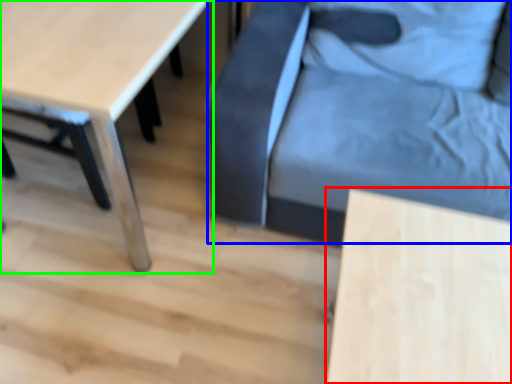
Question: Which object is the farthest from table (highlighted by a red box)? Choose among these: swivel chair (highlighted by a blue box) or table (highlighted by a green box).

Choices:
 (A) swivel chair
 (B) table

Answer: (B)